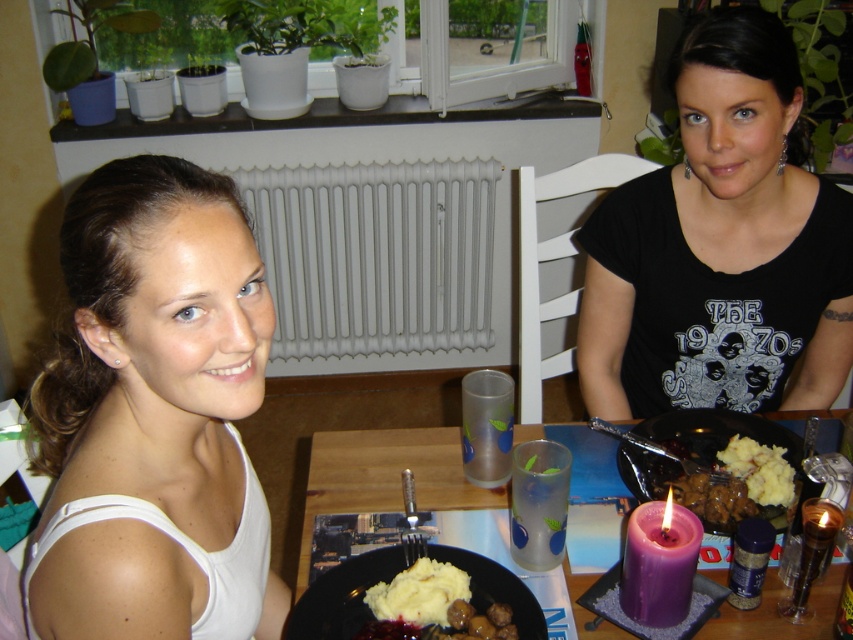
You are standing 60 inches away from the camera. A point at coordinates (209,444) is part of an object in the image. Can you reach that point without moving closer to the camera?

The point at coordinates (209,444) is 31.96 inches from the camera. Since you are standing 60 inches away, it is farther away from you than your current position, so you cannot reach it without moving closer.

You are a photographer taking a picture of the scene. You want to focus on the white matte tank top at upper left and the smooth creamy mashed potatoes at center. Which object should you adjust your camera to the left to capture better?

The white matte tank top at upper left is to the left of the smooth creamy mashed potatoes at center, so adjusting the camera to the left would better capture the white matte tank top at upper left.

You are a food delivery person who needs to place a hot dish between the matte black plate with mashed potatoes and meatballs at center and the matte brown meat at right on the dining table. The dish is 20 centimeters wide. Can you fit it between them without moving the existing items?

The distance between the matte black plate with mashed potatoes and meatballs at center and the matte brown meat at right is 19.46 centimeters. Since the dish is 20 centimeters wide, it is slightly wider than the available space, so it cannot be placed between them without moving the existing items.